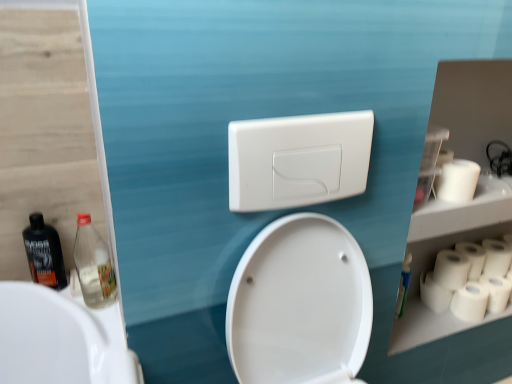
Question: In terms of width, does white matte toilet paper at right, which is the first toilet paper in top-to-bottom order, look wider or thinner when compared to white matte toilet paper at right, placed as the 1th toilet paper when sorted from bottom to top?

Choices:
 (A) wide
 (B) thin

Answer: (A)

Question: Is white matte toilet paper at right, which is the first toilet paper in top-to-bottom order, inside or outside of white matte toilet paper at right, placed as the 1th toilet paper when sorted from bottom to top?

Choices:
 (A) inside
 (B) outside

Answer: (B)

Question: Estimate the real-world distances between objects in this image. Which object is farther from the matte black bottle at left, which is counted as the first bottle, starting from the left?

Choices:
 (A) white matte paper towel at right
 (B) white plastic switch at upper center
 (C) clear plastic bottle at left, placed as the 2th bottle when sorted from left to right
 (D) white matte toilet paper at right, which appears as the 6th toilet paper when ordered from the bottom
 (E) white matte toilet paper at right, the fifth toilet paper when ordered from bottom to top

Answer: (E)

Question: Which object is the closest to the white matte paper towel at right?

Choices:
 (A) white plastic switch at upper center
 (B) clear plastic bottle at left, which is the first bottle in right-to-left order
 (C) matte black bottle at left, which is counted as the first bottle, starting from the left
 (D) white matte toilet paper at right, placed as the 3th toilet paper when sorted from bottom to top
 (E) white matte toilet paper at right, the second toilet paper when ordered from bottom to top

Answer: (D)